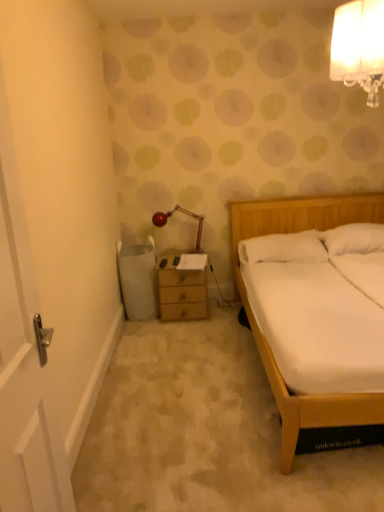
Question: Is metallic red lamp at upper center, which appears as the 1th lamp when viewed from the left, at the back of white glass lampshade at upper right, acting as the 1th lamp starting from the right?

Choices:
 (A) yes
 (B) no

Answer: (B)

Question: Would you say metallic red lamp at upper center, which ranks as the 1th lamp in bottom-to-top order, is part of white glass lampshade at upper right, placed as the first lamp when sorted from top to bottom,'s contents?

Choices:
 (A) no
 (B) yes

Answer: (A)

Question: Does white glass lampshade at upper right, which is the 1th lamp from front to back, have a lesser width compared to metallic red lamp at upper center, which is counted as the 1th lamp, starting from the back?

Choices:
 (A) no
 (B) yes

Answer: (A)

Question: Considering the relative sizes of white glass lampshade at upper right, acting as the 2th lamp starting from the left, and metallic red lamp at upper center, which ranks as the 1th lamp in bottom-to-top order, in the image provided, is white glass lampshade at upper right, acting as the 2th lamp starting from the left, bigger than metallic red lamp at upper center, which ranks as the 1th lamp in bottom-to-top order,?

Choices:
 (A) yes
 (B) no

Answer: (A)

Question: Is white glass lampshade at upper right, which is the 1th lamp from front to back, shorter than metallic red lamp at upper center, which is counted as the 1th lamp, starting from the back?

Choices:
 (A) no
 (B) yes

Answer: (A)

Question: Is white glass lampshade at upper right, which is the 1th lamp from front to back, positioned beyond the bounds of metallic red lamp at upper center, which ranks as the second lamp in front-to-back order?

Choices:
 (A) no
 (B) yes

Answer: (B)

Question: Does metallic red lamp at upper center, which is the 2th lamp from top to bottom, lie behind white soft pillow at right, marked as the 1th pillow in a left-to-right arrangement?

Choices:
 (A) yes
 (B) no

Answer: (A)

Question: Is metallic red lamp at upper center, which is counted as the 2th lamp, starting from the right, thinner than white soft pillow at right, marked as the 1th pillow in a left-to-right arrangement?

Choices:
 (A) no
 (B) yes

Answer: (B)

Question: From the image's perspective, would you say metallic red lamp at upper center, which ranks as the second lamp in front-to-back order, is positioned over white soft pillow at right, marked as the 1th pillow in a left-to-right arrangement?

Choices:
 (A) yes
 (B) no

Answer: (A)

Question: Does metallic red lamp at upper center, which ranks as the 1th lamp in bottom-to-top order, appear on the right side of white soft pillow at right, marked as the 1th pillow in a left-to-right arrangement?

Choices:
 (A) no
 (B) yes

Answer: (A)

Question: Can you confirm if metallic red lamp at upper center, which is counted as the 2th lamp, starting from the right, is wider than white soft pillow at right, marked as the 1th pillow in a left-to-right arrangement?

Choices:
 (A) no
 (B) yes

Answer: (A)

Question: From a real-world perspective, is metallic red lamp at upper center, which is counted as the 1th lamp, starting from the back, on white soft pillow at right, marked as the 1th pillow in a left-to-right arrangement?

Choices:
 (A) no
 (B) yes

Answer: (B)

Question: Considering the relative sizes of white glass lampshade at upper right, which is counted as the 2th lamp, starting from the bottom, and white soft pillow at right, which ranks as the second pillow in right-to-left order, in the image provided, is white glass lampshade at upper right, which is counted as the 2th lamp, starting from the bottom, thinner than white soft pillow at right, which ranks as the second pillow in right-to-left order,?

Choices:
 (A) yes
 (B) no

Answer: (A)